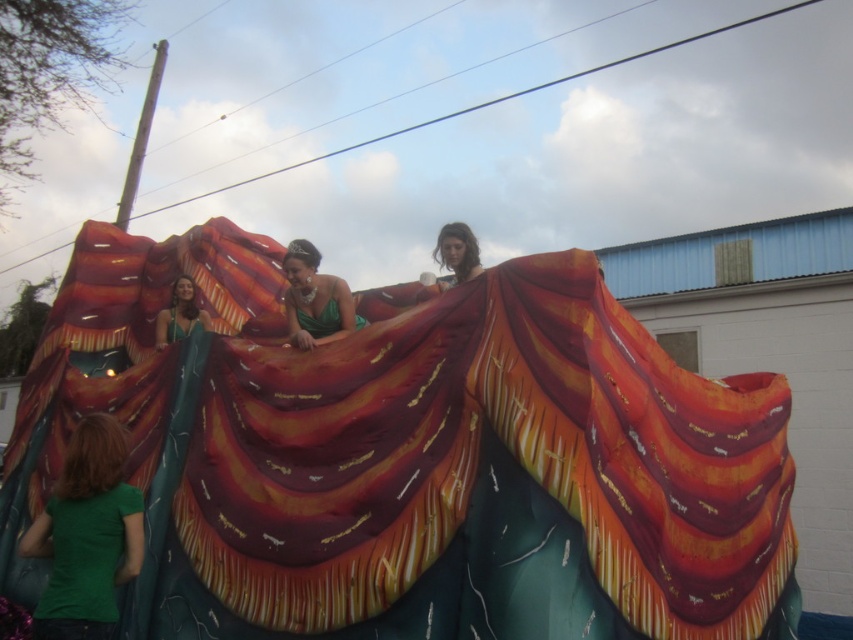
Question: Which point appears farthest from the camera in this image?

Choices:
 (A) (190, 292)
 (B) (456, 428)

Answer: (A)

Question: Can you confirm if green satin dress at center is positioned to the right of green satin dress at upper left?

Choices:
 (A) yes
 (B) no

Answer: (A)

Question: Does green matte shirt at lower left appear on the left side of green satin dress at upper left?

Choices:
 (A) no
 (B) yes

Answer: (A)

Question: Which object appears farthest from the camera in this image?

Choices:
 (A) shiny metallic blanket at center
 (B) green satin dress at center
 (C) green matte shirt at lower left
 (D) matte green fabric at upper center

Answer: (D)

Question: Can you confirm if green matte shirt at lower left is positioned below green satin dress at center?

Choices:
 (A) no
 (B) yes

Answer: (B)

Question: Among these objects, which one is farthest from the camera?

Choices:
 (A) green satin dress at center
 (B) green matte shirt at lower left
 (C) shiny metallic blanket at center

Answer: (A)